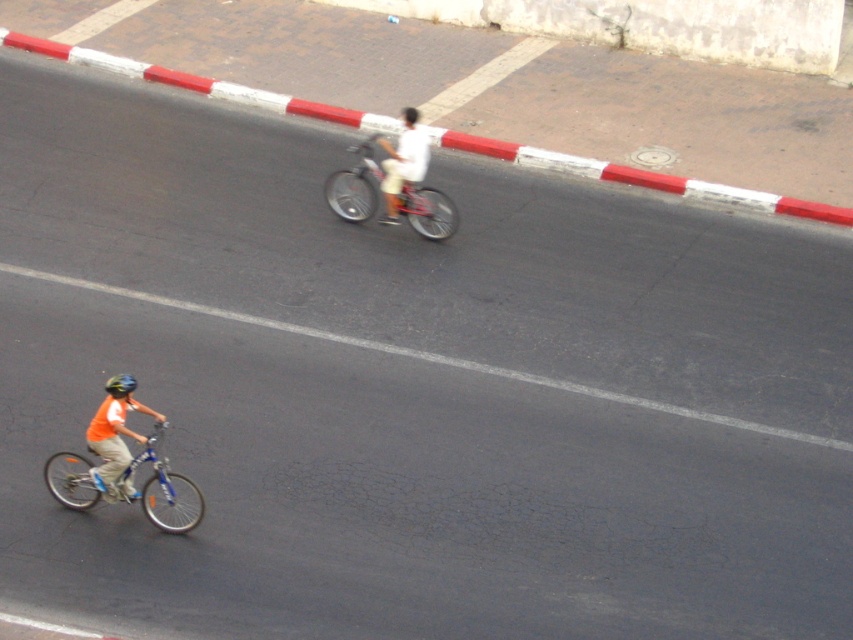
Is orange t-shirt at left thinner than shiny black helmet at lower left?

No, orange t-shirt at left is not thinner than shiny black helmet at lower left.

Who is more forward, (93, 432) or (123, 396)?

Point (123, 396) is more forward.

Where is `orange t-shirt at left`? orange t-shirt at left is located at coordinates [115, 436].

Who is more distant from viewer, (436,193) or (426,141)?

Positioned behind is point (436,193).

Is the position of metallic silver bicycle at center less distant than that of white matte shirt at center?

No.

Is point (433, 211) positioned in front of point (416, 148)?

No, (433, 211) is behind (416, 148).

Find the location of a particular element. The image size is (853, 640). metallic silver bicycle at center is located at coordinates (357, 184).

At what (x,y) coordinates should I click in order to perform the action: click on orange t-shirt at left. Please return your answer as a coordinate pair (x, y). Looking at the image, I should click on (115, 436).

Is point (115, 456) positioned behind point (387, 180)?

No.

At what (x,y) coordinates should I click in order to perform the action: click on orange t-shirt at left. Please return your answer as a coordinate pair (x, y). This screenshot has height=640, width=853. Looking at the image, I should click on [x=115, y=436].